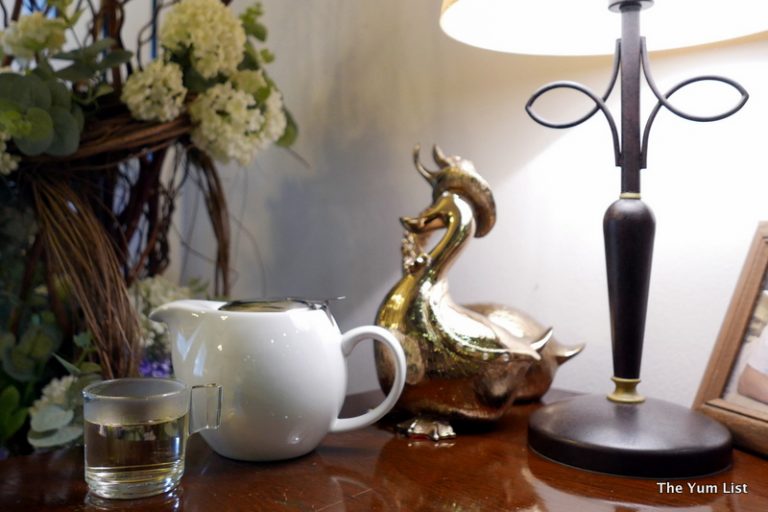
The image size is (768, 512). I want to click on glass, so click(163, 447).